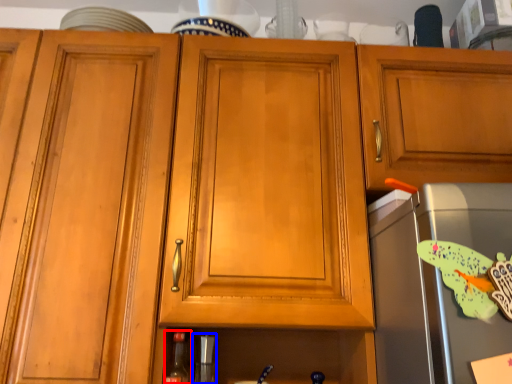
Question: Which object appears closest to the camera in this image, bottle (highlighted by a red box) or appliance (highlighted by a blue box)?

Choices:
 (A) bottle
 (B) appliance

Answer: (A)